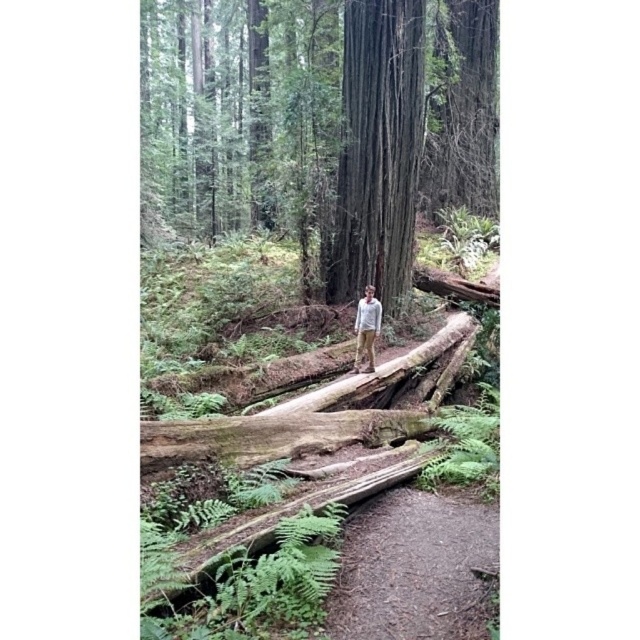
You are a hiker who wants to take a photo of the smooth brown trunk at center from a specific location. To ensure the trunk is in the frame, where should you position yourself relative to the trunk?

The smooth brown trunk at center is located at point (316, 125), so you should position yourself directly in front of this coordinate to capture it in the frame.

You are a hiker who wants to take a photo of the light gray sweater at center and the smooth brown trunk at center together in the frame. Which object should you move closer to so that both are visible in the photo?

You should move closer to the smooth brown trunk at center because the light gray sweater at center is behind it. By moving closer to the trunk, you can ensure both the trunk and the sweater are visible in the photo without one blocking the other.

You are planning to take a photo of the smooth brown trunk at center and the brown dirt path at lower center. Which object should you focus on first if you want to capture both in a single frame without moving the camera?

You should focus on the smooth brown trunk at center first because it is taller than the brown dirt path at lower center, so it will occupy more space in the frame and ensure both are visible.